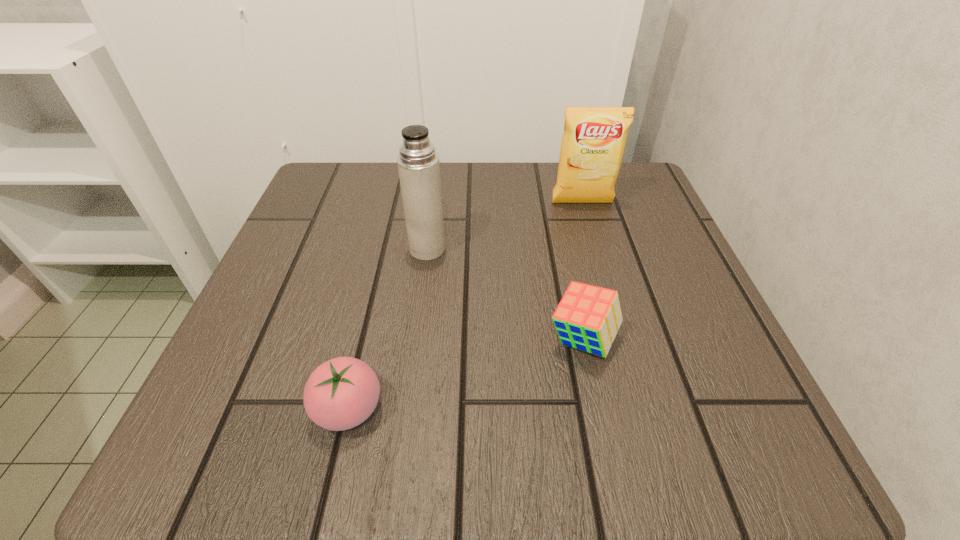
Identify the location of free area in between the third farthest object and the farthest object. (583, 272).

Find the location of a particular element. This screenshot has height=540, width=960. object that is the second closest to the farthest object is located at coordinates (588, 317).

Identify which object is the closest to the cube. Please provide its 2D coordinates. Your answer should be formatted as a tuple, i.e. [(x, y)], where the tuple contains the x and y coordinates of a point satisfying the conditions above.

[(418, 163)]

What are the coordinates of `free spot that satisfies the following two spatial constraints: 1. on the front side of the second farthest object; 2. on the right side of the cube` in the screenshot? It's located at (416, 340).

Identify the location of free region that satisfies the following two spatial constraints: 1. on the back side of the third nearest object; 2. on the right side of the tomato. (386, 249).

The width and height of the screenshot is (960, 540). Find the location of `vacant space that satisfies the following two spatial constraints: 1. on the back side of the tomato; 2. on the left side of the second nearest object`. vacant space that satisfies the following two spatial constraints: 1. on the back side of the tomato; 2. on the left side of the second nearest object is located at coordinates (365, 340).